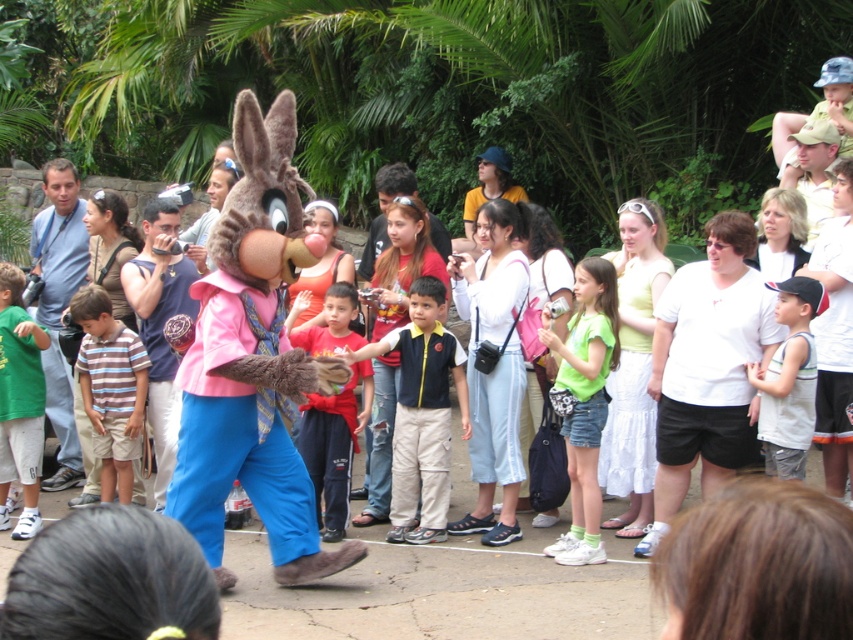
You are a costume designer observing the scene. You need to decide which item, the velvet plush bunny at center or the white cotton tank top at center, would require more vertical storage space. Based on the scene, which one is taller?

The velvet plush bunny at center is taller than the white cotton tank top at center, so it would require more vertical storage space.

You are organizing a photo shoot and need to arrange the velvet plush bunny at center and the red cotton shirt at center side by side on a table. Given their sizes, which object should be placed first to ensure they fit properly?

The velvet plush bunny at center is wider than the red cotton shirt at center. Therefore, place the velvet plush bunny at center first to accommodate its larger width, then position the red cotton shirt at center next to it.